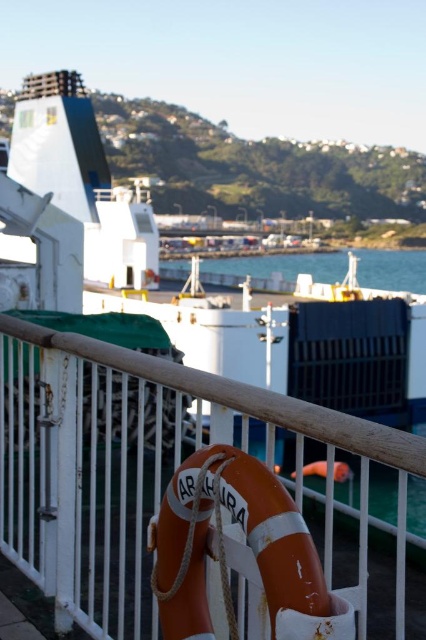
Question: Does orange matte life jacket at center have a smaller size compared to blue water at center?

Choices:
 (A) yes
 (B) no

Answer: (A)

Question: Estimate the real-world distances between objects in this image. Which object is farther from the white metal fence at center?

Choices:
 (A) orange matte life jacket at center
 (B) blue water at center

Answer: (B)

Question: Which of the following is the closest to the observer?

Choices:
 (A) blue water at center
 (B) white metal fence at center
 (C) orange matte life jacket at center

Answer: (C)

Question: Which of the following is the farthest from the observer?

Choices:
 (A) (350, 419)
 (B) (176, 554)

Answer: (B)

Question: Is white metal fence at center smaller than blue water at center?

Choices:
 (A) yes
 (B) no

Answer: (A)

Question: Does white metal fence at center have a lesser width compared to orange matte life jacket at center?

Choices:
 (A) no
 (B) yes

Answer: (A)